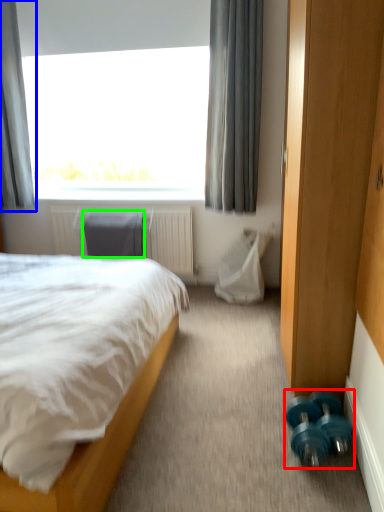
Question: Which object is the farthest from dumbbell (highlighted by a red box)? Choose among these: curtain (highlighted by a blue box) or swivel chair (highlighted by a green box).

Choices:
 (A) curtain
 (B) swivel chair

Answer: (A)